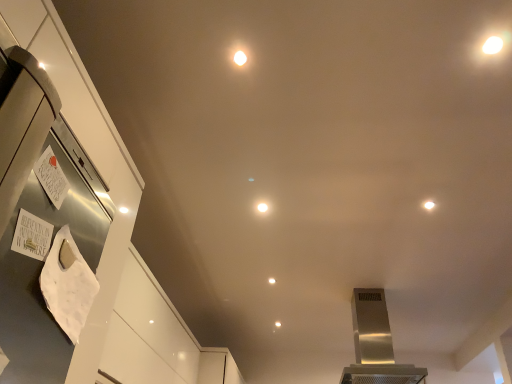
Question: Considering the relative sizes of stainless steel range hood at center and matte white light at center, which appears as the third light when viewed from the front, in the image provided, is stainless steel range hood at center smaller than matte white light at center, which appears as the third light when viewed from the front,?

Choices:
 (A) yes
 (B) no

Answer: (B)

Question: Considering the relative sizes of stainless steel range hood at center and matte white light at center, marked as the 3th light in a top-to-bottom arrangement, in the image provided, is stainless steel range hood at center shorter than matte white light at center, marked as the 3th light in a top-to-bottom arrangement,?

Choices:
 (A) yes
 (B) no

Answer: (B)

Question: Could you tell me if stainless steel range hood at center is turned towards matte white light at center, the 3th light from the left?

Choices:
 (A) yes
 (B) no

Answer: (B)

Question: Is matte white light at center, the 3th light from the left, at the back of stainless steel range hood at center?

Choices:
 (A) yes
 (B) no

Answer: (A)

Question: Is stainless steel range hood at center directly adjacent to matte white light at center, marked as the 3th light in a top-to-bottom arrangement?

Choices:
 (A) yes
 (B) no

Answer: (B)

Question: From a real-world perspective, is white glossy light at upper center, which ranks as the 3th light in right-to-left order, physically located above or below matte white light at center, which is counted as the first light, starting from the bottom?

Choices:
 (A) above
 (B) below

Answer: (A)

Question: From their relative heights in the image, would you say white glossy light at upper center, arranged as the 1th light when viewed from the front, is taller or shorter than matte white light at center, which appears as the third light when viewed from the front?

Choices:
 (A) short
 (B) tall

Answer: (B)

Question: Considering the positions of point (245, 56) and point (271, 279), is point (245, 56) closer or farther from the camera than point (271, 279)?

Choices:
 (A) farther
 (B) closer

Answer: (B)

Question: From the image's perspective, relative to matte white light at center, the 3th light from the left, is white glossy light at upper center, arranged as the 1th light when viewed from the front, above or below?

Choices:
 (A) below
 (B) above

Answer: (B)

Question: Considering the relative positions of stainless steel range hood at center and white glossy light at upper center, which appears as the 1th light when viewed from the left, in the image provided, is stainless steel range hood at center to the left or to the right of white glossy light at upper center, which appears as the 1th light when viewed from the left,?

Choices:
 (A) left
 (B) right

Answer: (B)

Question: Is stainless steel range hood at center wider or thinner than white glossy light at upper center, which ranks as the 3th light in right-to-left order?

Choices:
 (A) thin
 (B) wide

Answer: (B)

Question: From the image's perspective, relative to white glossy light at upper center, arranged as the 3th light when viewed from the back, is stainless steel range hood at center above or below?

Choices:
 (A) below
 (B) above

Answer: (A)

Question: Considering their positions, is stainless steel range hood at center located in front of or behind white glossy light at upper center, which appears as the 1th light when viewed from the left?

Choices:
 (A) behind
 (B) front

Answer: (A)

Question: In the image, is white glossy light at center, which is the 2th light from left to right, positioned in front of or behind matte white light at center, the 3th light from the left?

Choices:
 (A) front
 (B) behind

Answer: (A)

Question: Visually, is white glossy light at center, the second light from the right, positioned to the left or to the right of matte white light at center, the 1th light positioned from the back?

Choices:
 (A) right
 (B) left

Answer: (B)